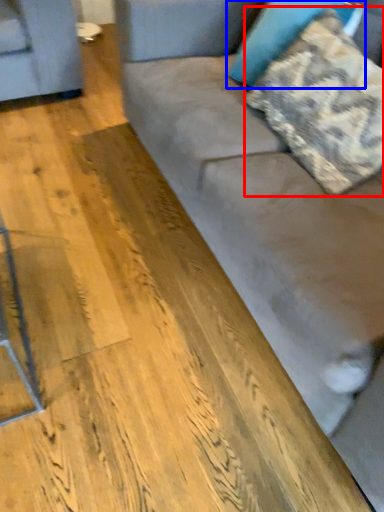
Question: Which object appears closest to the camera in this image, pillow (highlighted by a red box) or pillow (highlighted by a blue box)?

Choices:
 (A) pillow
 (B) pillow

Answer: (A)